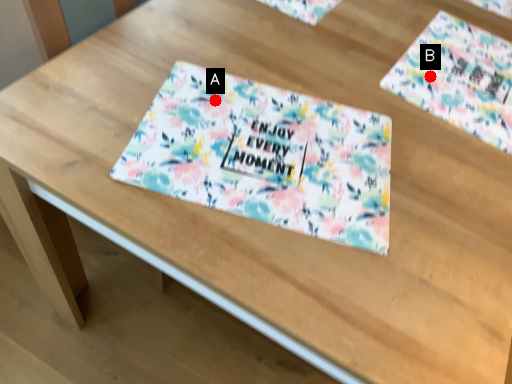
Question: Two points are circled on the image, labeled by A and B beside each circle. Among these points, which one is farthest from the camera?

Choices:
 (A) A is further
 (B) B is further

Answer: (B)